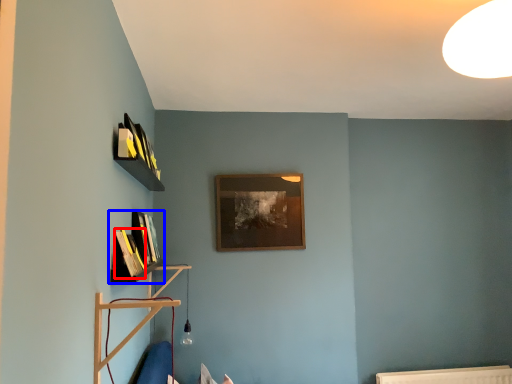
Question: Which of the following is the closest to the observer, book (highlighted by a red box) or shelf (highlighted by a blue box)?

Choices:
 (A) book
 (B) shelf

Answer: (B)